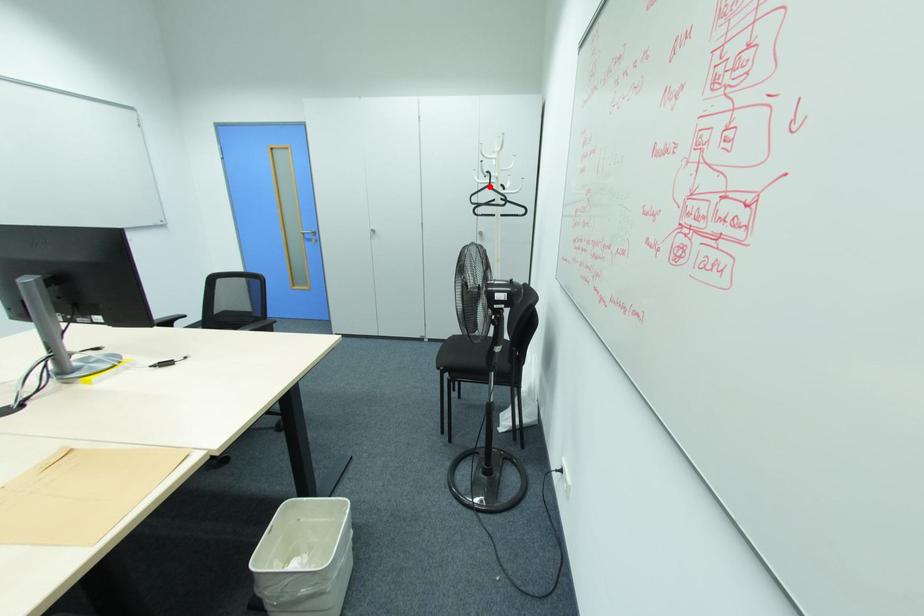
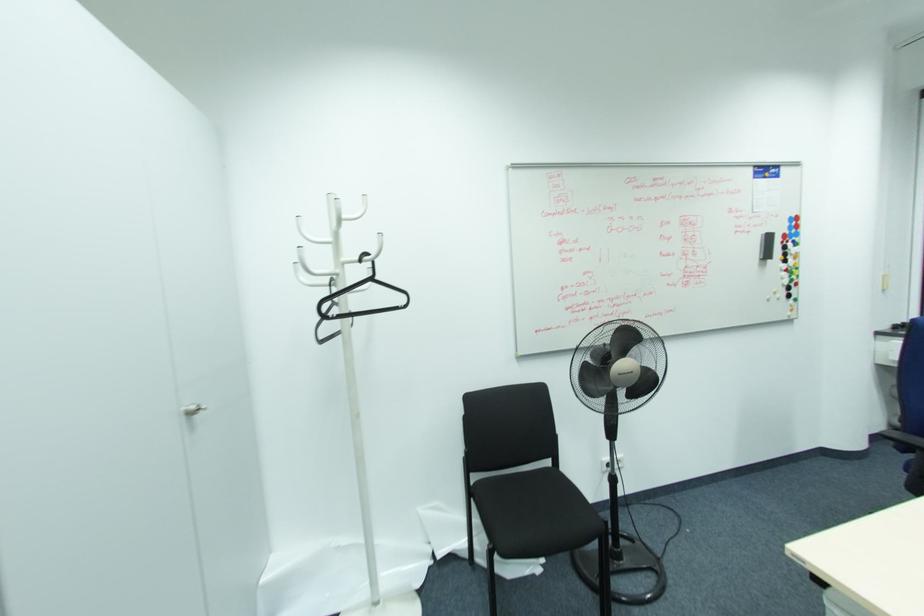
Find the pixel in the second image that matches the highlighted location in the first image.

(371, 280)